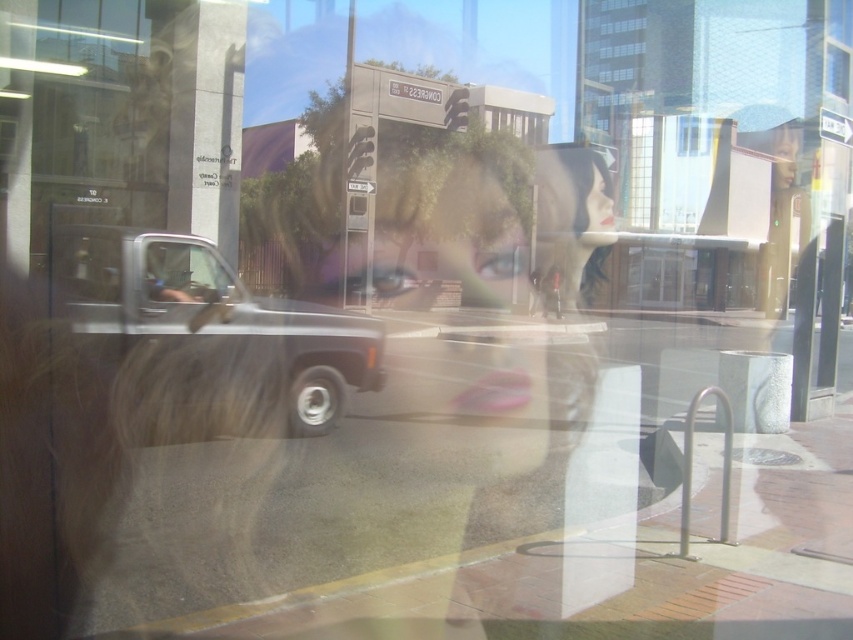
Is silver metallic truck at center smaller than clear glass window at center?

Yes, silver metallic truck at center is smaller than clear glass window at center.

Can you confirm if silver metallic truck at center is taller than clear glass window at center?

In fact, silver metallic truck at center may be shorter than clear glass window at center.

Where is `silver metallic truck at center`? The width and height of the screenshot is (853, 640). silver metallic truck at center is located at coordinates (206, 337).